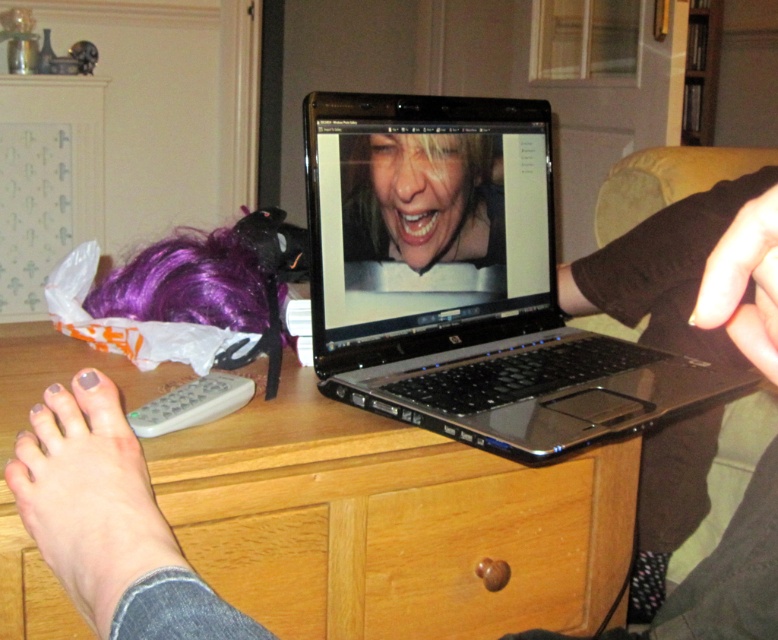
Between point (461, 170) and point (37, 470), which one is positioned in front?

Point (37, 470) is more forward.

From the picture: Which is more to the left, black glossy laptop at center or matte gray nail polish at lower left?

Positioned to the left is matte gray nail polish at lower left.

Between point (426, 196) and point (128, 500), which one is positioned behind?

Point (426, 196)

At what (x,y) coordinates should I click in order to perform the action: click on black glossy laptop at center. Please return your answer as a coordinate pair (x, y). This screenshot has height=640, width=778. Looking at the image, I should click on (426, 211).

Which of these two, black glossy laptop at center or wooden heart-shaped knob at center, stands taller?

With more height is black glossy laptop at center.

Which is more to the right, black glossy laptop at center or wooden heart-shaped knob at center?

wooden heart-shaped knob at center is more to the right.

Between point (430, 140) and point (461, 572), which one is positioned in front?

Point (461, 572) is in front.

Identify the location of black glossy laptop at center. This screenshot has height=640, width=778. (426, 211).

Which is in front, point (121, 456) or point (128, 419)?

Point (121, 456)

Is matte gray nail polish at lower left wider than gray rubber remote at lower left?

Yes.

What are the coordinates of `matte gray nail polish at lower left` in the screenshot? It's located at (89, 497).

The image size is (778, 640). Identify the location of matte gray nail polish at lower left. (89, 497).